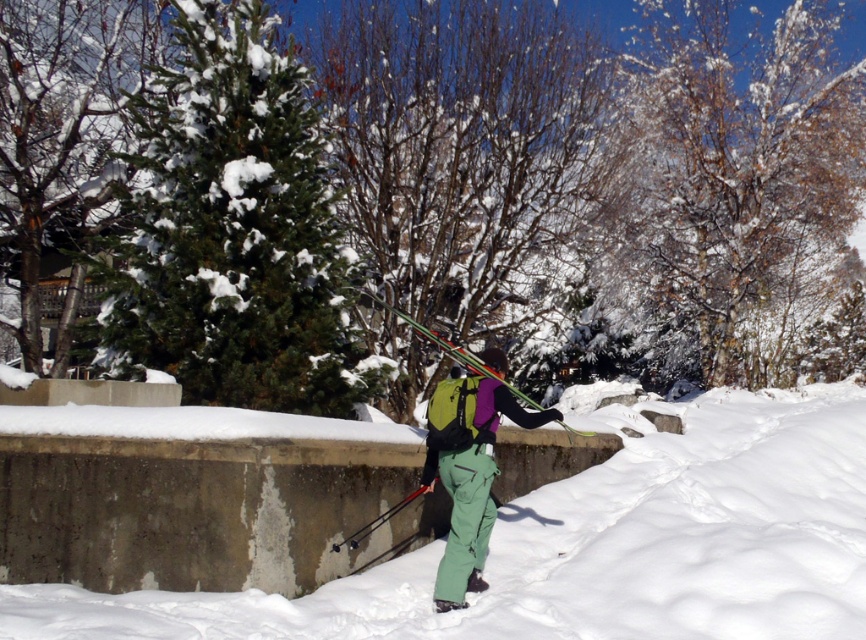
Question: Is snow-covered branches at upper center positioned before green matte snow pants at center?

Choices:
 (A) no
 (B) yes

Answer: (A)

Question: Which of the following is the closest to the observer?

Choices:
 (A) (37, 19)
 (B) (837, 468)

Answer: (B)

Question: Which of the following is the farthest from the observer?

Choices:
 (A) green textured evergreen tree at upper left
 (B) green matte snow pants at center
 (C) green matte tree at center
 (D) white powdery snow at lower center

Answer: (C)

Question: Among these points, which one is nearest to the camera?

Choices:
 (A) (141, 621)
 (B) (574, 308)
 (C) (460, 602)
 (D) (124, 209)

Answer: (A)

Question: Is green evergreen tree at left in front of green matte snow pants at center?

Choices:
 (A) yes
 (B) no

Answer: (B)

Question: Does green matte tree at center have a smaller size compared to green matte ski at center?

Choices:
 (A) yes
 (B) no

Answer: (A)